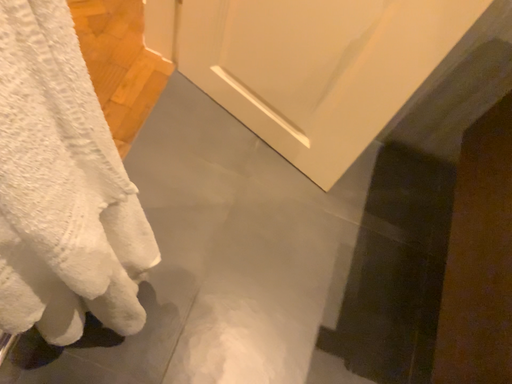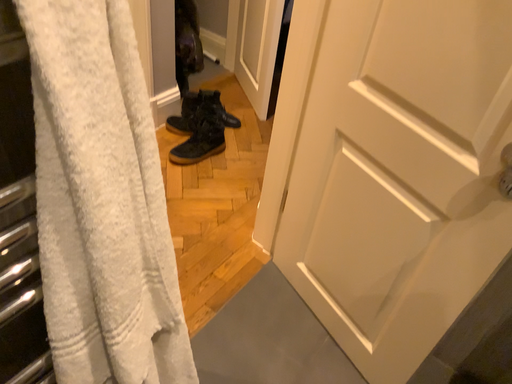
Question: How did the camera likely rotate when shooting the video?

Choices:
 (A) rotated left
 (B) rotated right

Answer: (A)